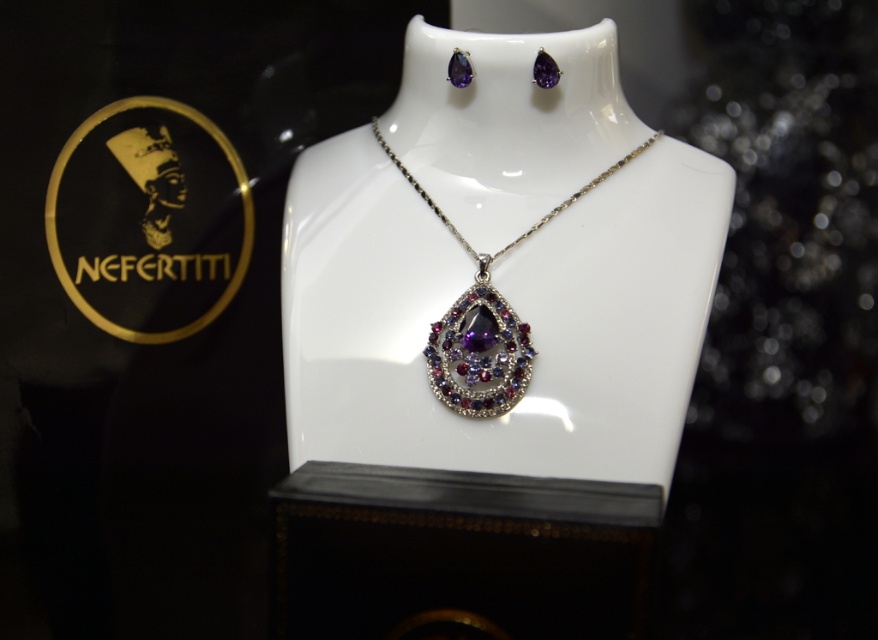
Consider the image. You are a photographer adjusting your camera to focus on two points in the image. The first point is labeled as point (x=207, y=140) and the second is point (x=464, y=317). Since you want to focus on the closer point to ensure clarity, which point should you choose?

Point (x=207, y=140) is closer to the camera than point (x=464, y=317), so you should focus on point (x=207, y=140).